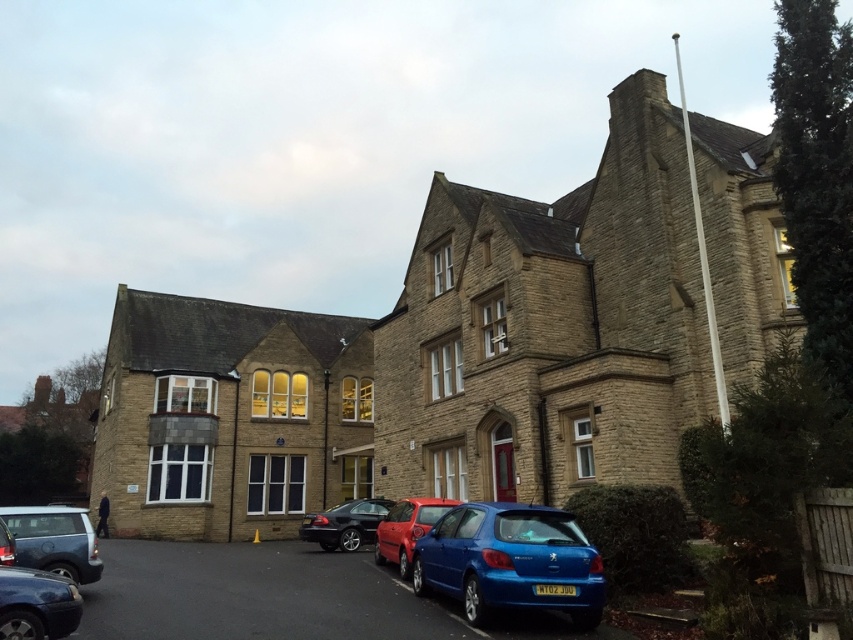
You are a delivery driver who needs to park your van between the matte red car at center and the metallic silver car at lower left. Can you fit your van there if it requires 2 meters of space?

The matte red car at center is positioned on the right side of metallic silver car at lower left. However, the distance between them isn not specified in the provided information, so it is unclear if there is enough space for the van.

You are a delivery person arriving at the building and need to park your vehicle. You see a matte silver suv at lower left and a metallic silver car at lower left. Which vehicle is closer to the left side of the paved area?

The matte silver suv at lower left is closer to the left side of the paved area because it is positioned to the left of the metallic silver car at lower left.

You are a delivery driver who needs to park your truck, which is 2 meters wide, in the parking area in front of the building. You see the matte silver suv at lower left and the matte red car at center. Which vehicle has enough space between it and the building to accommodate your truck?

The matte silver suv at lower left has a width surpassing the matte red car at center, so the space next to the matte silver suv at lower left is wider. Therefore, the truck can fit between the matte silver suv at lower left and the building.